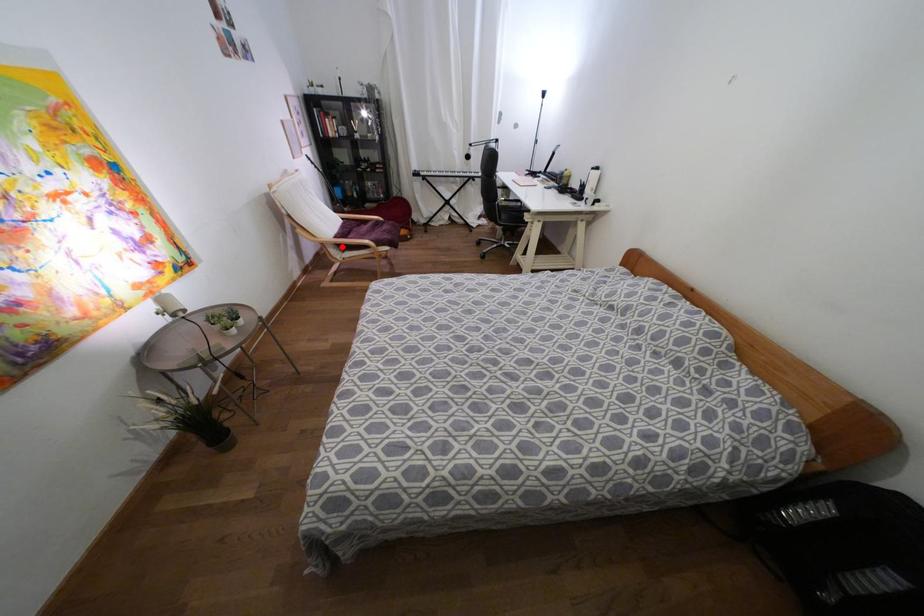
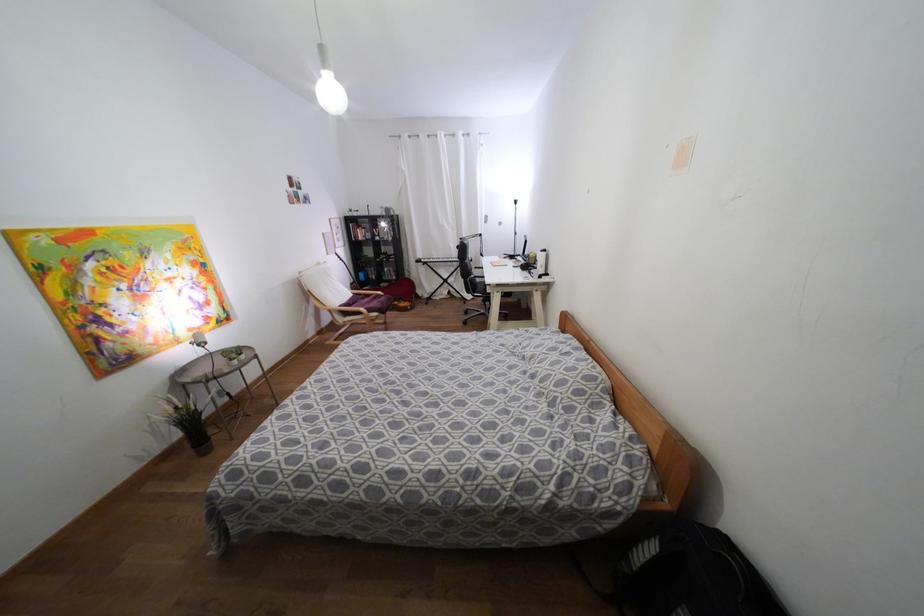
Question: I am providing you with two images of the same scene from different viewpoints. Image1 has a red point marked. In image2, the corresponding 3D location appears at what relative position? Reply with the corresponding letter.

Choices:
 (A) Closer
 (B) Farther

Answer: (B)